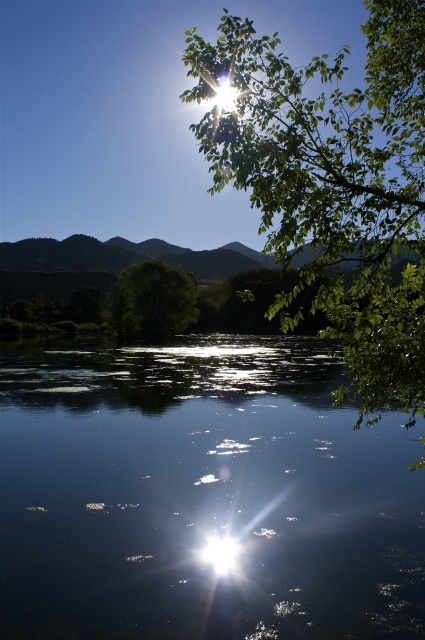
In the scene shown: Can you confirm if transparent water at center is taller than green leafy tree at upper right?

In fact, transparent water at center may be shorter than green leafy tree at upper right.

Who is more forward, (x=302, y=476) or (x=336, y=227)?

Point (x=336, y=227) is more forward.

This screenshot has width=425, height=640. Identify the location of transparent water at center. (201, 496).

You are a GUI agent. You are given a task and a screenshot of the screen. Output one action in this format:
    pyautogui.click(x=<x>, y=<y>)
    Task: Click on the green leafy tree at upper right
    
    Given the screenshot: What is the action you would take?
    pyautogui.click(x=333, y=184)

Is green leafy tree at upper right to the left of green leafy tree at center from the viewer's perspective?

No, green leafy tree at upper right is not to the left of green leafy tree at center.

What do you see at coordinates (333, 184) in the screenshot? Image resolution: width=425 pixels, height=640 pixels. I see `green leafy tree at upper right` at bounding box center [333, 184].

In order to click on green leafy tree at upper right in this screenshot , I will do `click(333, 184)`.

Where is `transparent water at center`? transparent water at center is located at coordinates (201, 496).

This screenshot has height=640, width=425. Identify the location of transparent water at center. (201, 496).